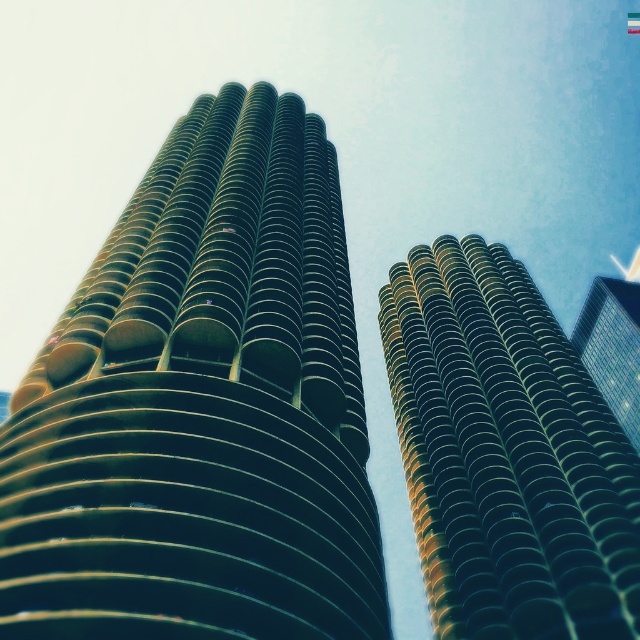
You are standing in front of two green glass buildings. The green glass building at center and the green glass skyscraper at right. Which one appears larger to you?

The green glass building at center appears larger because it is closer to the viewer than the green glass skyscraper at right.

You are an architect evaluating the two central skyscrapers in the image. Based on their appearance, which one do you think has a larger footprint? The options are the green matte tower at center and the green glass building at center.

The green matte tower at center might be wider than green glass building at center, so it likely has a larger footprint.